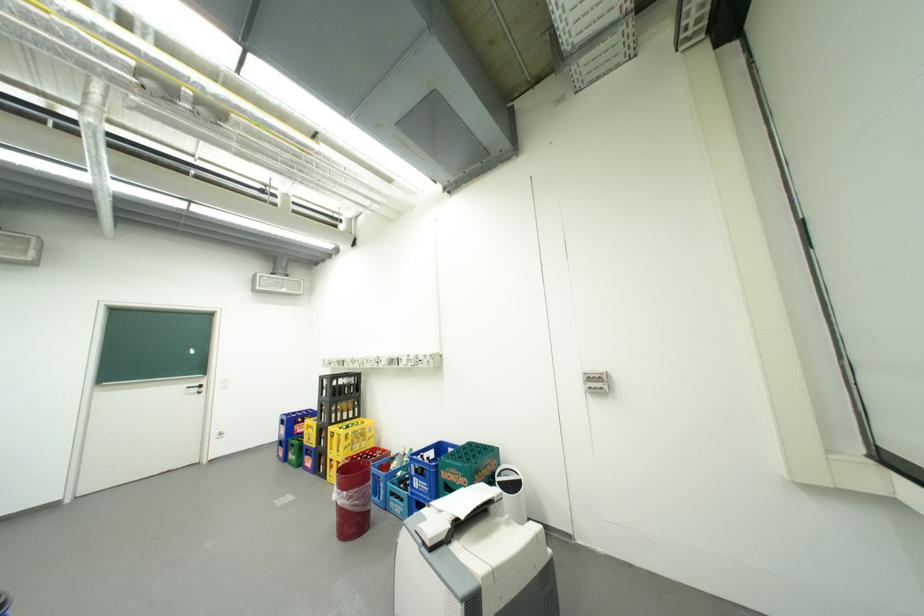
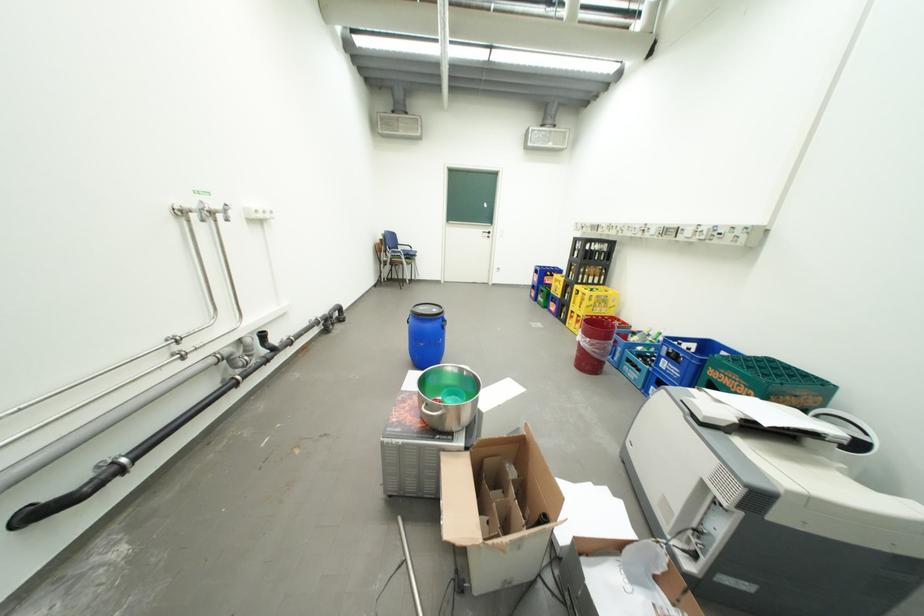
Locate, in the second image, the point that corresponds to point (424, 480) in the first image.

(674, 361)